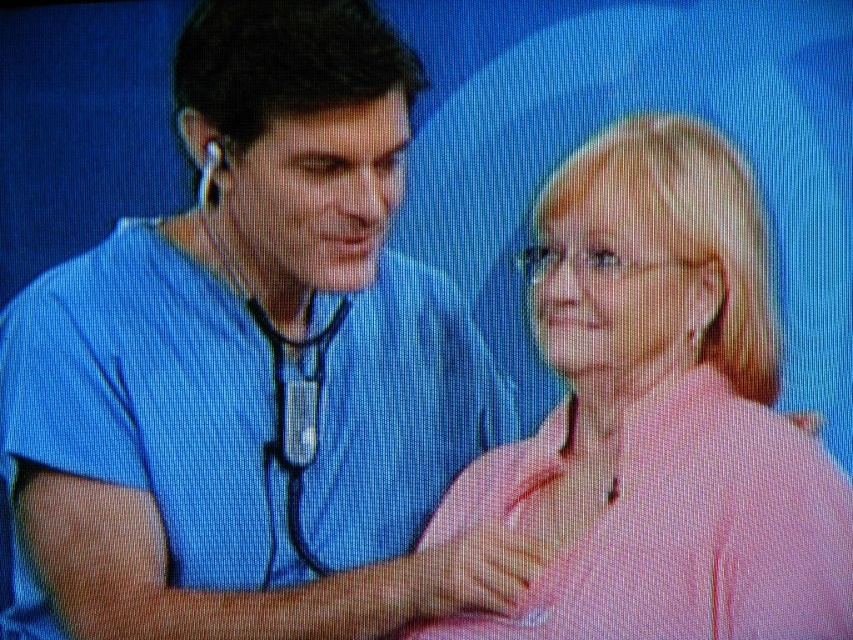
Who is positioned more to the right, matte blue shirt at center or matte black stethoscope at center?

matte black stethoscope at center is more to the right.

Which is in front, point (177, 529) or point (309, 426)?

Point (177, 529) is in front.

Describe the element at coordinates (254, 369) in the screenshot. I see `matte blue shirt at center` at that location.

At what (x,y) coordinates should I click in order to perform the action: click on matte blue shirt at center. Please return your answer as a coordinate pair (x, y). Looking at the image, I should click on (254, 369).

Between matte blue shirt at center and pink fabric shirt at center, which one appears on the left side from the viewer's perspective?

Positioned to the left is matte blue shirt at center.

Is matte blue shirt at center bigger than pink fabric shirt at center?

Indeed, matte blue shirt at center has a larger size compared to pink fabric shirt at center.

Does point (473, 330) lie behind point (699, 627)?

Yes.

Identify the location of matte blue shirt at center. (254, 369).

Can you confirm if pink fabric shirt at center is wider than matte black stethoscope at center?

Indeed, pink fabric shirt at center has a greater width compared to matte black stethoscope at center.

Between pink fabric shirt at center and matte black stethoscope at center, which one has less height?

matte black stethoscope at center is shorter.

Image resolution: width=853 pixels, height=640 pixels. What are the coordinates of `pink fabric shirt at center` in the screenshot? It's located at (659, 416).